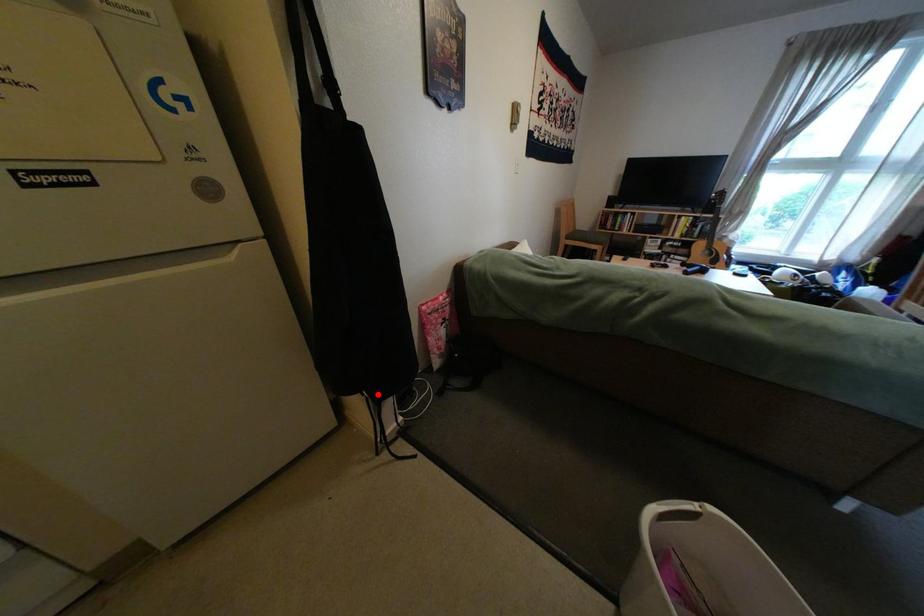
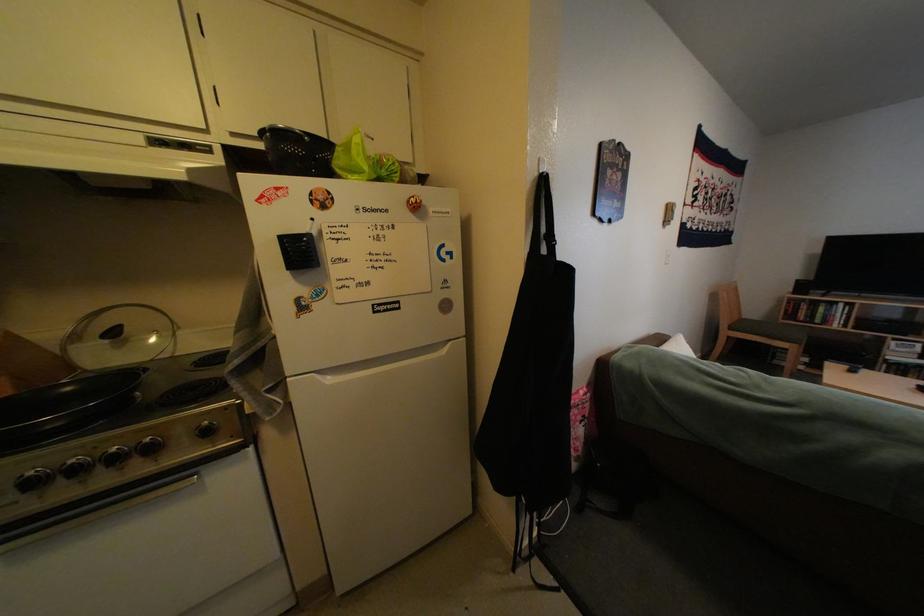
Question: I am providing you with two images of the same scene from different viewpoints. Image1 has a red point marked. In image2, the corresponding 3D location appears at what relative position? Reply with the corresponding letter.

Choices:
 (A) Closer
 (B) Farther

Answer: (B)